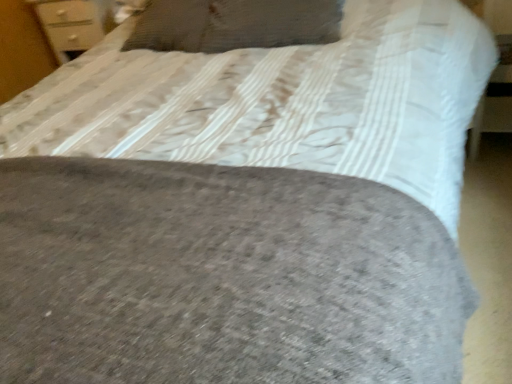
The height and width of the screenshot is (384, 512). What are the coordinates of `matte white dresser at upper left` in the screenshot? It's located at (22, 49).

What do you see at coordinates (22, 49) in the screenshot? This screenshot has width=512, height=384. I see `matte white dresser at upper left` at bounding box center [22, 49].

Identify the location of woolen pillow at upper center. The width and height of the screenshot is (512, 384). (233, 24).

The image size is (512, 384). What do you see at coordinates (233, 24) in the screenshot?
I see `woolen pillow at upper center` at bounding box center [233, 24].

What is the approximate width of woolen pillow at upper center?

woolen pillow at upper center is 15.43 inches wide.

Where is `matte white dresser at upper left`? The image size is (512, 384). matte white dresser at upper left is located at coordinates (22, 49).

Considering the positions of objects woolen pillow at upper center and matte white dresser at upper left in the image provided, who is more to the right, woolen pillow at upper center or matte white dresser at upper left?

Positioned to the right is woolen pillow at upper center.

Is the depth of woolen pillow at upper center greater than that of matte white dresser at upper left?

No, the depth of woolen pillow at upper center is less than that of matte white dresser at upper left.

Is point (224, 42) closer or farther from the camera than point (37, 73)?

Point (224, 42) appears to be closer to the viewer than point (37, 73).

From the image's perspective, who appears lower, woolen pillow at upper center or matte white dresser at upper left?

woolen pillow at upper center appears lower in the image.

From a real-world perspective, which is physically below, woolen pillow at upper center or matte white dresser at upper left?

matte white dresser at upper left.

Which of these two, woolen pillow at upper center or matte white dresser at upper left, is thinner?

matte white dresser at upper left.

Does woolen pillow at upper center have a lesser height compared to matte white dresser at upper left?

Correct, woolen pillow at upper center is not as tall as matte white dresser at upper left.

Who is smaller, woolen pillow at upper center or matte white dresser at upper left?

With smaller size is woolen pillow at upper center.

Is woolen pillow at upper center located outside matte white dresser at upper left?

Yes, woolen pillow at upper center is outside of matte white dresser at upper left.

Is woolen pillow at upper center beside matte white dresser at upper left?

woolen pillow at upper center and matte white dresser at upper left are not in contact.

Is woolen pillow at upper center facing towards matte white dresser at upper left?

No, woolen pillow at upper center does not turn towards matte white dresser at upper left.

How different are the orientations of woolen pillow at upper center and matte white dresser at upper left in degrees?

woolen pillow at upper center and matte white dresser at upper left are facing 11.4 degrees away from each other.

Find the location of a particular element. The width and height of the screenshot is (512, 384). pillow located on the right of matte white dresser at upper left is located at coordinates (233, 24).

Does matte white dresser at upper left appear on the left side of woolen pillow at upper center?

Yes.

Who is more distant, matte white dresser at upper left or woolen pillow at upper center?

matte white dresser at upper left.

Considering the points (35, 80) and (167, 45), which point is in front, point (35, 80) or point (167, 45)?

The point (167, 45) is more forward.

From the image's perspective, does matte white dresser at upper left appear higher than woolen pillow at upper center?

Correct, matte white dresser at upper left appears higher than woolen pillow at upper center in the image.

From a real-world perspective, is matte white dresser at upper left positioned under woolen pillow at upper center based on gravity?

Yes, from a real-world perspective, matte white dresser at upper left is below woolen pillow at upper center.

Which object is thinner, matte white dresser at upper left or woolen pillow at upper center?

Thinner between the two is matte white dresser at upper left.

Consider the image. Can you confirm if matte white dresser at upper left is taller than woolen pillow at upper center?

Yes.

Which of these two, matte white dresser at upper left or woolen pillow at upper center, is bigger?

With larger size is matte white dresser at upper left.

Which is correct: matte white dresser at upper left is inside woolen pillow at upper center, or outside of it?

matte white dresser at upper left is located beyond the bounds of woolen pillow at upper center.

Is matte white dresser at upper left touching woolen pillow at upper center?

There is a gap between matte white dresser at upper left and woolen pillow at upper center.

Is matte white dresser at upper left facing away from woolen pillow at upper center?

No, woolen pillow at upper center is not at the back of matte white dresser at upper left.

What's the angular difference between matte white dresser at upper left and woolen pillow at upper center's facing directions?

The angular difference between matte white dresser at upper left and woolen pillow at upper center is 11.4 degrees.

Where is `pillow that appears below the matte white dresser at upper left (from the image's perspective)`? pillow that appears below the matte white dresser at upper left (from the image's perspective) is located at coordinates (233, 24).

This screenshot has width=512, height=384. What are the coordinates of `dresser lying behind the woolen pillow at upper center` in the screenshot? It's located at (22, 49).

The width and height of the screenshot is (512, 384). I want to click on pillow lying on the right of matte white dresser at upper left, so click(233, 24).